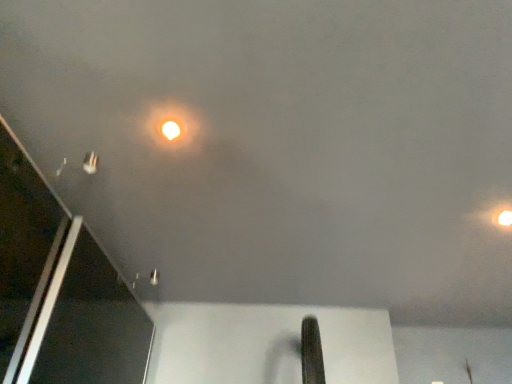
Image resolution: width=512 pixels, height=384 pixels. What do you see at coordinates (503, 217) in the screenshot? I see `matte white light at upper right` at bounding box center [503, 217].

The height and width of the screenshot is (384, 512). Identify the location of matte white light at upper right. (503, 217).

Locate an element on the screen. matte white light at upper right is located at coordinates (503, 217).